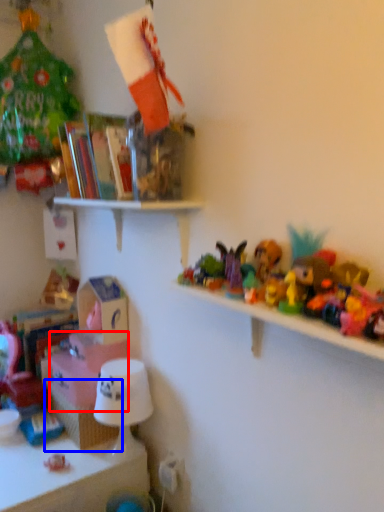
Question: Among these objects, which one is nearest to the camera, box (highlighted by a red box) or shelf (highlighted by a blue box)?

Choices:
 (A) box
 (B) shelf

Answer: (B)